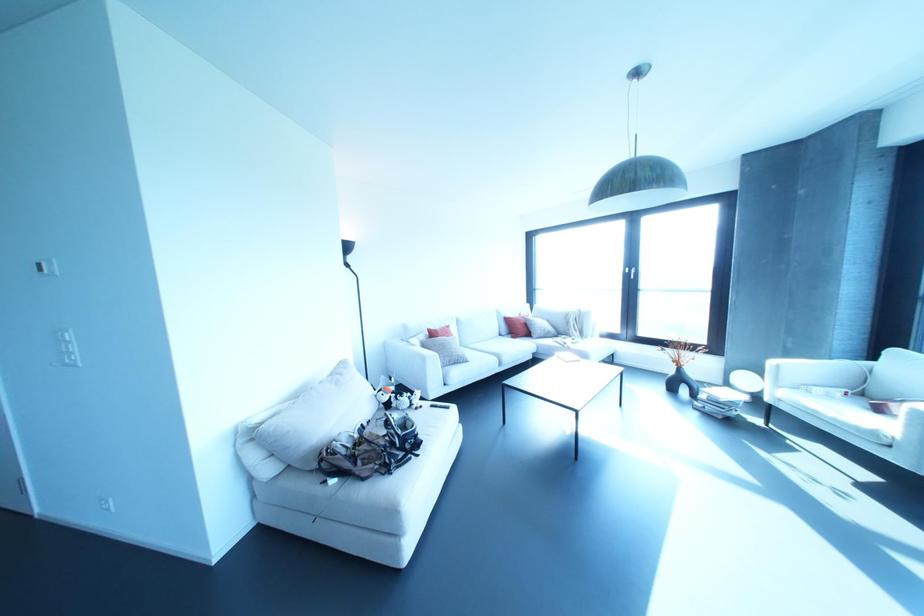
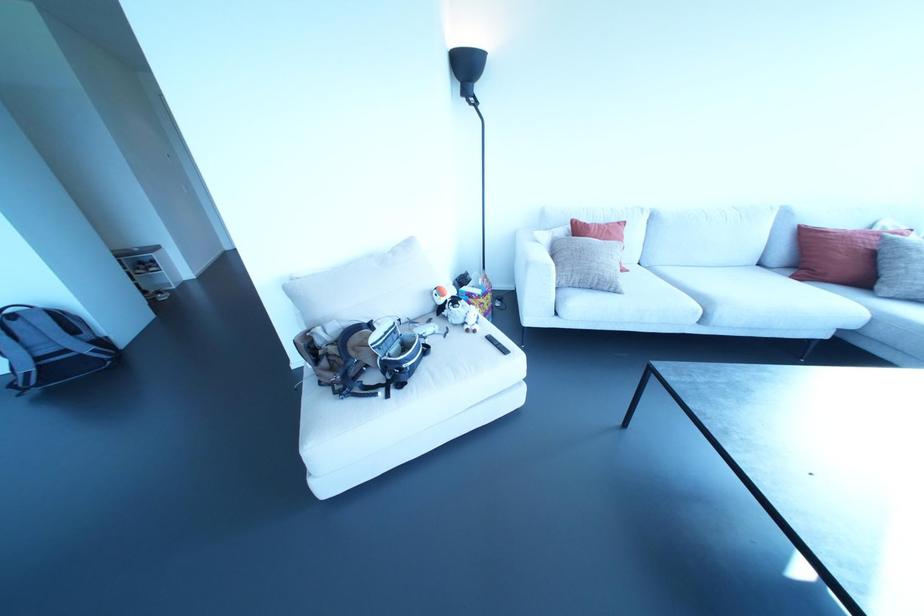
In the second image, find the point that corresponds to (x=416, y=408) in the first image.

(467, 330)